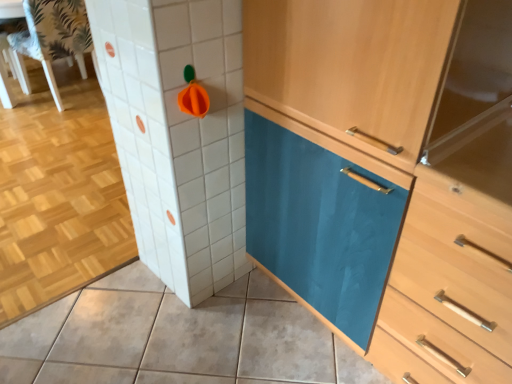
Question: Is light wood/wooden chest of drawers at center taller than matte ceramic tile at lower center?

Choices:
 (A) no
 (B) yes

Answer: (B)

Question: Is light wood/wooden chest of drawers at center looking in the opposite direction of matte ceramic tile at lower center?

Choices:
 (A) yes
 (B) no

Answer: (B)

Question: From a real-world perspective, does light wood/wooden chest of drawers at center stand above matte ceramic tile at lower center?

Choices:
 (A) no
 (B) yes

Answer: (B)

Question: Does light wood/wooden chest of drawers at center have a lesser height compared to matte ceramic tile at lower center?

Choices:
 (A) no
 (B) yes

Answer: (A)

Question: Considering the relative positions of light wood/wooden chest of drawers at center and matte ceramic tile at lower center in the image provided, is light wood/wooden chest of drawers at center to the left of matte ceramic tile at lower center from the viewer's perspective?

Choices:
 (A) yes
 (B) no

Answer: (B)

Question: Does light wood/wooden chest of drawers at center have a greater width compared to matte ceramic tile at lower center?

Choices:
 (A) no
 (B) yes

Answer: (A)

Question: Can you confirm if white fabric chair at upper left is positioned to the right of light wood/wooden chest of drawers at center?

Choices:
 (A) no
 (B) yes

Answer: (A)

Question: Is white fabric chair at upper left not close to light wood/wooden chest of drawers at center?

Choices:
 (A) no
 (B) yes

Answer: (B)

Question: Does white fabric chair at upper left touch light wood/wooden chest of drawers at center?

Choices:
 (A) no
 (B) yes

Answer: (A)

Question: Is white fabric chair at upper left taller than light wood/wooden chest of drawers at center?

Choices:
 (A) no
 (B) yes

Answer: (A)

Question: Is light wood/wooden chest of drawers at center at the back of white fabric chair at upper left?

Choices:
 (A) yes
 (B) no

Answer: (A)

Question: From a real-world perspective, is white fabric chair at upper left physically above light wood/wooden chest of drawers at center?

Choices:
 (A) yes
 (B) no

Answer: (B)

Question: Does matte ceramic tile at lower center have a greater width compared to teal glossy cabinet at center?

Choices:
 (A) yes
 (B) no

Answer: (A)